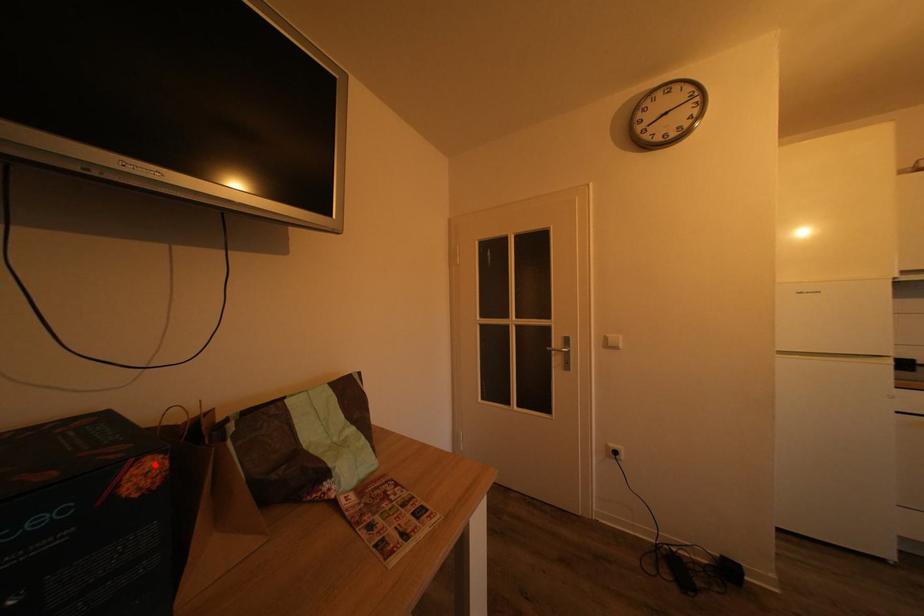
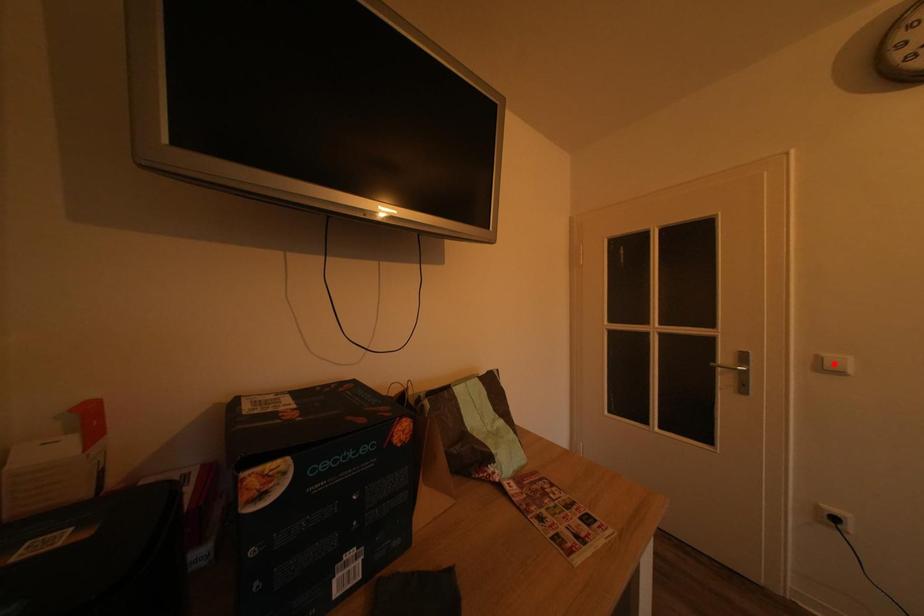
I am providing you with two images of the same scene from different viewpoints. A red point is marked on the first image and another point is marked on the second image. Does the point marked in image1 correspond to the same location as the one in image2?

No